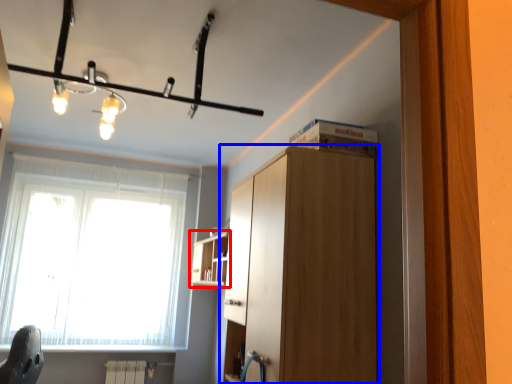
Question: Which object appears closest to the camera in this image, shelf (highlighted by a red box) or cabinetry (highlighted by a blue box)?

Choices:
 (A) shelf
 (B) cabinetry

Answer: (B)